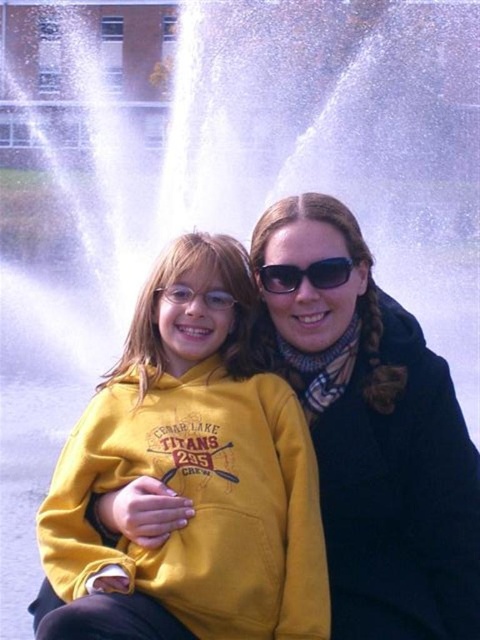
Question: Among these objects, which one is farthest from the camera?

Choices:
 (A) black plastic sunglasses at center
 (B) matte black jacket at center
 (C) yellow fleece hoodie at center

Answer: (A)

Question: Can you confirm if matte black jacket at center is smaller than black plastic sunglasses at center?

Choices:
 (A) yes
 (B) no

Answer: (B)

Question: Is yellow fleece hoodie at center to the left of matte black jacket at center from the viewer's perspective?

Choices:
 (A) no
 (B) yes

Answer: (B)

Question: Considering the real-world distances, which object is farthest from the black plastic sunglasses at center?

Choices:
 (A) yellow fleece hoodie at center
 (B) matte black jacket at center

Answer: (A)

Question: Does matte black jacket at center have a larger size compared to black plastic sunglasses at center?

Choices:
 (A) no
 (B) yes

Answer: (B)

Question: Which point is closer to the camera?

Choices:
 (A) (302, 275)
 (B) (124, 579)
 (C) (288, 362)

Answer: (B)